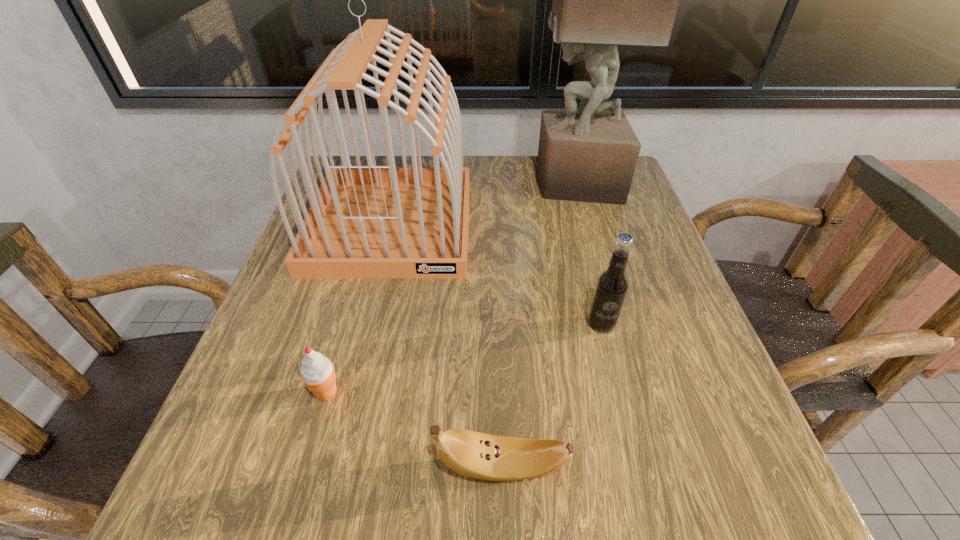
Locate an element on the screen. Image resolution: width=960 pixels, height=540 pixels. vacant space that satisfies the following two spatial constraints: 1. on the front-facing side of the sculpture; 2. on the front side of the banana is located at coordinates (659, 468).

This screenshot has height=540, width=960. I want to click on blank space that satisfies the following two spatial constraints: 1. on the front-facing side of the sculpture; 2. on the front side of the icecream, so click(x=636, y=393).